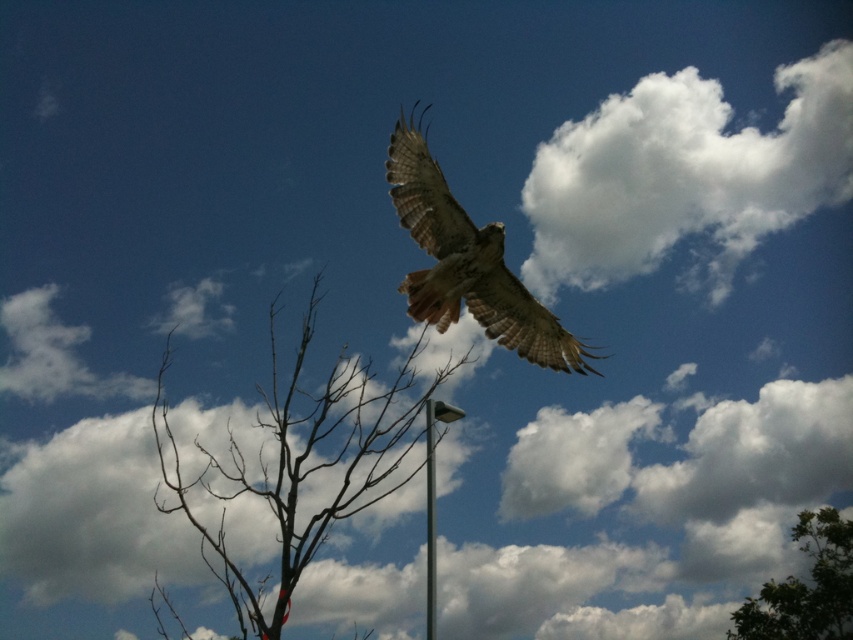
Consider the image. You are planning to install a bird feeder between the green leafy tree at lower right and the silver metallic pole at center. The feeder requires a minimum of 100 feet of space between the two objects to ensure safety. Can the feeder be placed there?

The green leafy tree at lower right and silver metallic pole at center are 100.58 feet apart from each other. Since the required minimum distance is 100 feet, the feeder can be safely placed between them as the distance meets the requirement.

You are a bird flying in the sky and you want to land on the nearest tree. There is a point marked at coordinates point (805, 588). Which tree should you head towards?

The point (805, 588) corresponds to the green leafy tree at lower right, so you should head towards the green leafy tree at lower right to land.